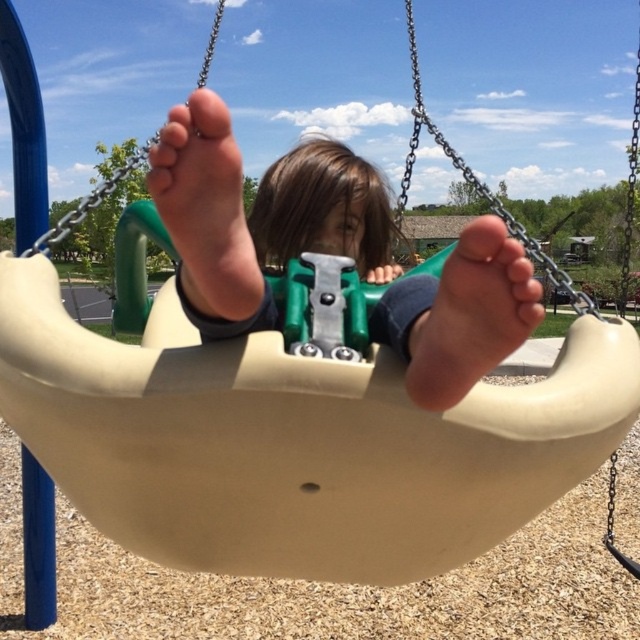
You are taking a photo of the playground scene. You notice two points in your viewfinder at coordinates point (433, 356) and point (198, 214). Which point will appear closer to the front of the image?

Point (433, 356) is further to the camera than point (198, 214), so the point (433, 356) will appear closer to the front of the image.

You are a parent at the playground. Your child is sitting on the beige plastic swing at center and you notice the pink soft skin at center. Which object is wider?

The beige plastic swing at center is wider than the pink soft skin at center.

You are a parent at the playground and want to ensure your child can safely reach the swing. Considering the beige plastic swing at center and the matte beige foot at center, which object is higher from the ground?

The beige plastic swing at center is much taller than the matte beige foot at center, so the swing is higher from the ground.